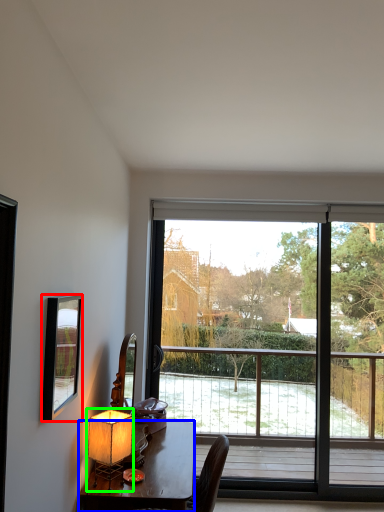
Question: Which object is the farthest from mirror (highlighted by a red box)? Choose among these: desk (highlighted by a blue box) or table lamp (highlighted by a green box).

Choices:
 (A) desk
 (B) table lamp

Answer: (A)